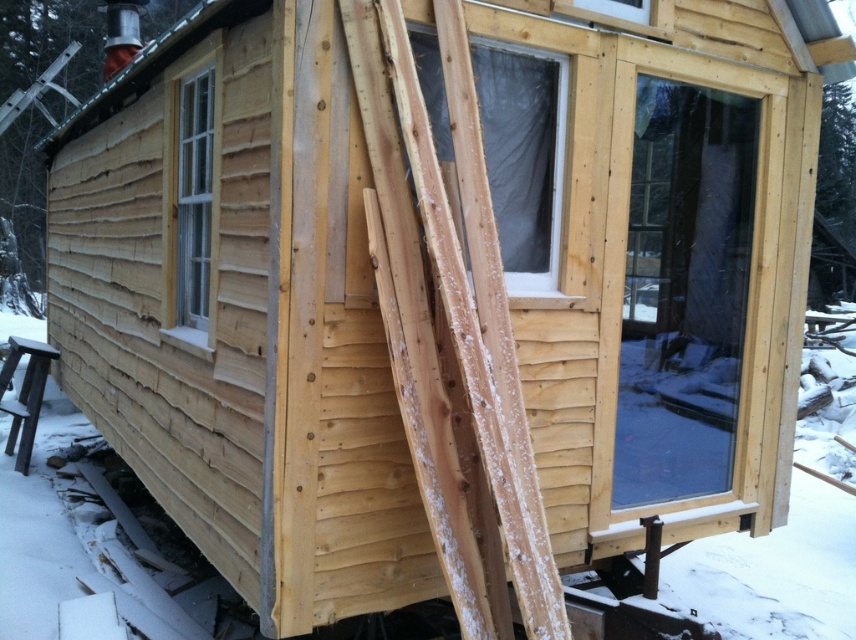
Is transparent glass door at right smaller than clear plastic window at center?

No, transparent glass door at right is not smaller than clear plastic window at center.

Which is behind, point (691, 240) or point (538, 168)?

Point (691, 240)

Does point (646, 349) come behind point (409, 38)?

Yes.

The width and height of the screenshot is (856, 640). Find the location of `transparent glass door at right`. transparent glass door at right is located at coordinates (682, 291).

Which of these two, clear plastic window at center or clear glass window at left, stands shorter?

Standing shorter between the two is clear plastic window at center.

Can you confirm if clear plastic window at center is positioned to the left of clear glass window at left?

No, clear plastic window at center is not to the left of clear glass window at left.

Which is in front, point (512, 192) or point (197, 312)?

Positioned in front is point (512, 192).

Image resolution: width=856 pixels, height=640 pixels. I want to click on clear plastic window at center, so click(522, 156).

Is transparent glass door at right thinner than clear glass window at left?

No, transparent glass door at right is not thinner than clear glass window at left.

Measure the distance between transparent glass door at right and clear glass window at left.

3.10 meters

Does point (649, 460) lie in front of point (177, 323)?

No, (649, 460) is further to viewer.

Image resolution: width=856 pixels, height=640 pixels. Identify the location of transparent glass door at right. (682, 291).